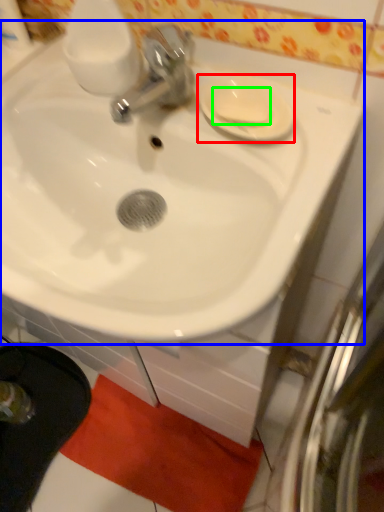
Question: Based on their relative distances, which object is farther from saucer (highlighted by a red box)? Choose from sink (highlighted by a blue box) and soap (highlighted by a green box).

Choices:
 (A) sink
 (B) soap

Answer: (A)